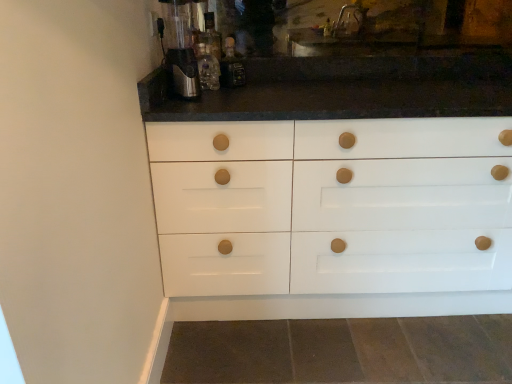
Question: Is translucent glass bottle at center, which ranks as the second bottle in left-to-right order, at the right side of translucent glass bottle at upper center, positioned as the first bottle in left-to-right order?

Choices:
 (A) yes
 (B) no

Answer: (A)

Question: Considering the relative sizes of translucent glass bottle at center, which is counted as the first bottle, starting from the right, and translucent glass bottle at upper center, the 2th bottle from the right, in the image provided, is translucent glass bottle at center, which is counted as the first bottle, starting from the right, thinner than translucent glass bottle at upper center, the 2th bottle from the right,?

Choices:
 (A) yes
 (B) no

Answer: (A)

Question: From the image's perspective, does translucent glass bottle at center, which is counted as the first bottle, starting from the right, appear lower than translucent glass bottle at upper center, positioned as the first bottle in left-to-right order?

Choices:
 (A) yes
 (B) no

Answer: (B)

Question: Considering the relative sizes of translucent glass bottle at center, which ranks as the second bottle in left-to-right order, and translucent glass bottle at upper center, the 2th bottle from the right, in the image provided, is translucent glass bottle at center, which ranks as the second bottle in left-to-right order, wider than translucent glass bottle at upper center, the 2th bottle from the right,?

Choices:
 (A) yes
 (B) no

Answer: (B)

Question: Does translucent glass bottle at center, which ranks as the second bottle in left-to-right order, have a larger size compared to translucent glass bottle at upper center, the 2th bottle from the right?

Choices:
 (A) no
 (B) yes

Answer: (B)

Question: Does translucent glass bottle at center, which ranks as the second bottle in left-to-right order, lie in front of translucent glass bottle at upper center, positioned as the first bottle in left-to-right order?

Choices:
 (A) no
 (B) yes

Answer: (A)

Question: Is translucent glass bottle at center, which is counted as the first bottle, starting from the right, surrounding satin silver coffee machine at upper left?

Choices:
 (A) yes
 (B) no

Answer: (B)

Question: Is translucent glass bottle at center, which is counted as the first bottle, starting from the right, positioned in front of satin silver coffee machine at upper left?

Choices:
 (A) no
 (B) yes

Answer: (A)

Question: Can you confirm if translucent glass bottle at center, which ranks as the second bottle in left-to-right order, is thinner than satin silver coffee machine at upper left?

Choices:
 (A) yes
 (B) no

Answer: (A)

Question: Is translucent glass bottle at center, which ranks as the second bottle in left-to-right order, taller than satin silver coffee machine at upper left?

Choices:
 (A) no
 (B) yes

Answer: (A)

Question: Does translucent glass bottle at center, which is counted as the first bottle, starting from the right, have a larger size compared to satin silver coffee machine at upper left?

Choices:
 (A) no
 (B) yes

Answer: (A)

Question: Are translucent glass bottle at center, which is counted as the first bottle, starting from the right, and satin silver coffee machine at upper left far apart?

Choices:
 (A) no
 (B) yes

Answer: (A)

Question: Can you confirm if translucent glass bottle at upper center, positioned as the first bottle in left-to-right order, is wider than satin silver coffee machine at upper left?

Choices:
 (A) no
 (B) yes

Answer: (A)